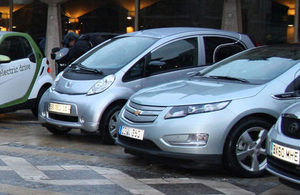
Locate an element on the screen. This screenshot has height=195, width=300. window is located at coordinates (27, 9), (93, 21), (168, 18), (262, 20).